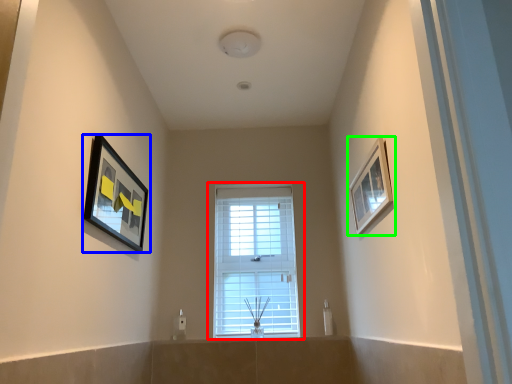
Question: Which object is the farthest from window (highlighted by a red box)? Choose among these: picture frame (highlighted by a blue box) or picture frame (highlighted by a green box).

Choices:
 (A) picture frame
 (B) picture frame

Answer: (A)